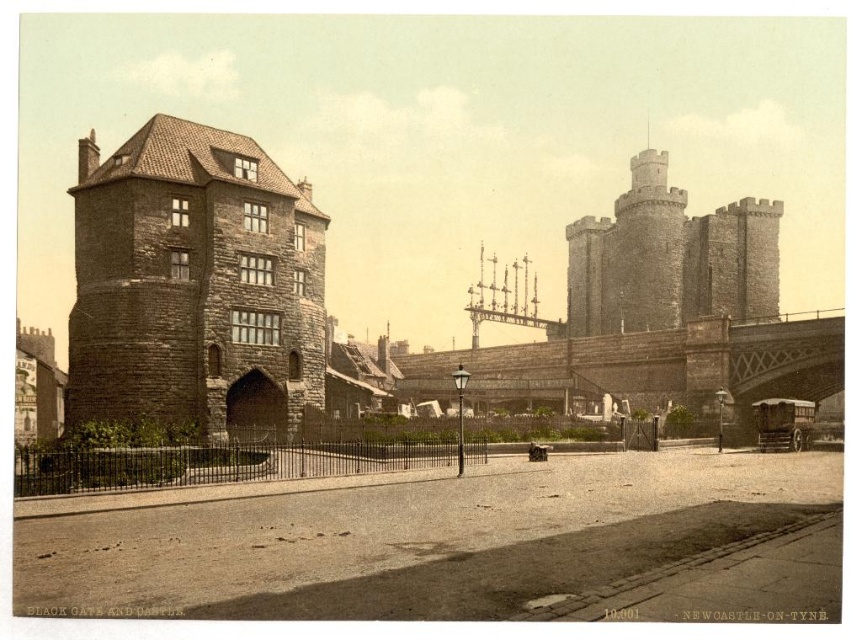
Which is more to the right, brown stone tower at left or brown stone bridge at center?

brown stone bridge at center

Where is `brown stone tower at left`? brown stone tower at left is located at coordinates (194, 284).